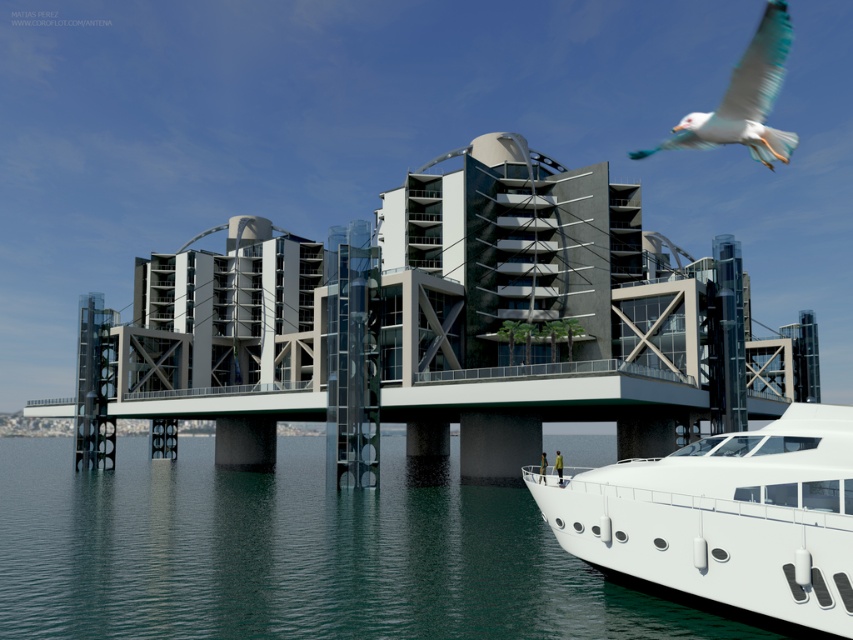
Question: Which point is closer to the camera?

Choices:
 (A) (793, 541)
 (B) (757, 154)
 (C) (514, 524)

Answer: (A)

Question: Can you confirm if greenish-blue water at lower left is wider than white feathered bird at upper right?

Choices:
 (A) no
 (B) yes

Answer: (B)

Question: Which of the following is the closest to the observer?

Choices:
 (A) (805, 518)
 (B) (778, 634)
 (C) (711, 144)

Answer: (A)

Question: Can you confirm if white glossy yacht at lower right is smaller than white feathered bird at upper right?

Choices:
 (A) no
 (B) yes

Answer: (B)

Question: Does greenish-blue water at lower left come in front of white glossy yacht at lower right?

Choices:
 (A) yes
 (B) no

Answer: (B)

Question: Which is nearer to the white feathered bird at upper right?

Choices:
 (A) greenish-blue water at lower left
 (B) white glossy yacht at lower right

Answer: (A)